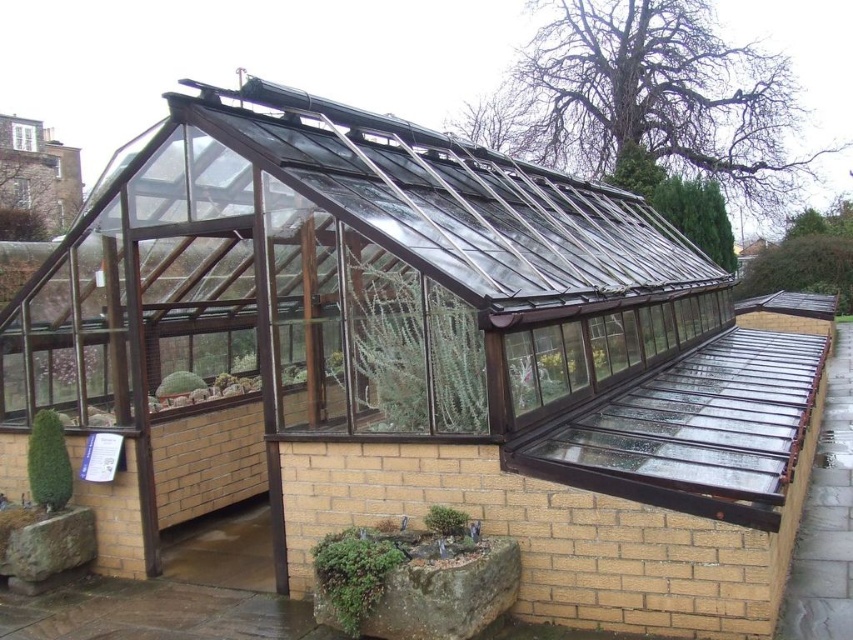
You are a gardener who needs to water both the green matte glass plant at center and the green matte cactus at center in the greenhouse. If your watering can has a range of 3 meters, can you water both plants without moving closer than 3 meters from your current position?

The green matte glass plant at center is 3.70 meters from the green matte cactus at center. Since the watering can has a range of 3 meters, you cannot water both plants without moving closer because the distance between them exceeds the watering can range.

You are a gardener who needs to place a 3.5 meter long hose between the green mossy rock at lower center and the green matte plant at center. Is the distance sufficient to accommodate the hose without bending it?

The distance between the green mossy rock at lower center and the green matte plant at center is 3.66 meters, which is longer than the 3.5 meter hose. Therefore, the hose can be placed straight between them without bending.

You are standing at the entrance of the greenhouse and want to walk to a specific location. You have two points marked as point 1 at coordinates point [340,272] and point 2 at coordinates point [224,372]. Which point is closer to you when you first enter the greenhouse?

Point [340,272] is in front of point [224,372], so it is closer to you when you first enter the greenhouse.